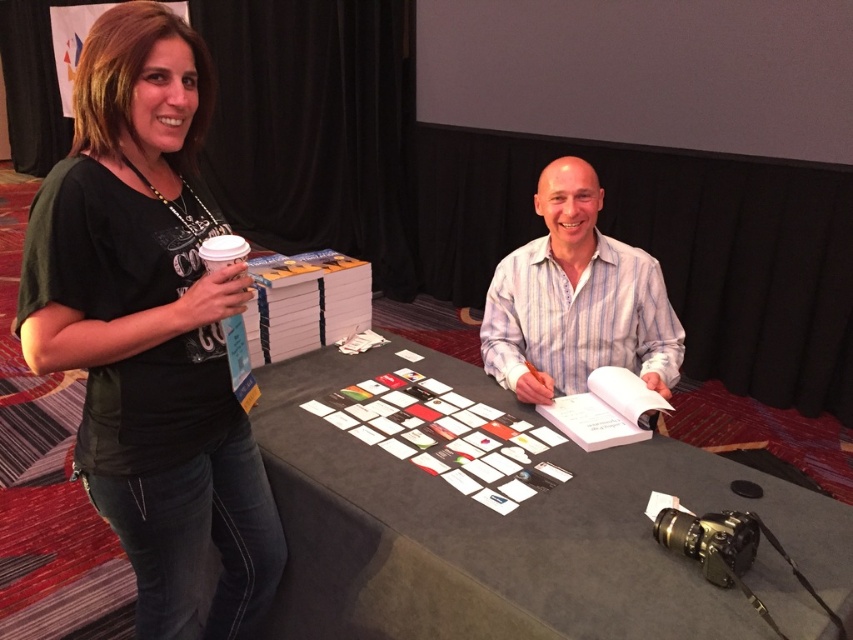
You are a photographer at the event and want to capture a photo where the black fabric table at center is clearly visible without being blocked by the white striped shirt at center. Based on their positions, is this possible?

Yes, because the black fabric table at center is in front of the white striped shirt at center, so it won not block the view of the table.